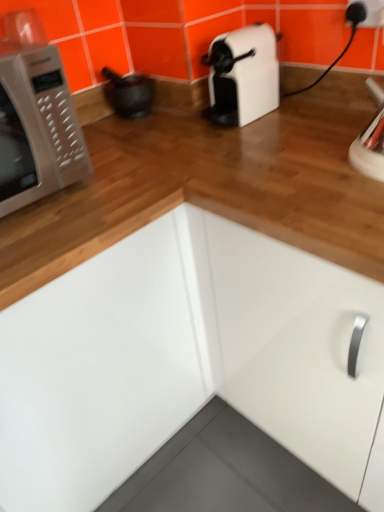
Describe the element at coordinates (183, 359) in the screenshot. I see `white glossy cabinet at center` at that location.

In order to click on white glossy cabinet at center in this screenshot , I will do `click(183, 359)`.

Is point (181, 327) positioned behind point (66, 88)?

Yes, point (181, 327) is farther from viewer.

Consider the image. Considering the positions of objects white glossy cabinet at center and white glossy microwave oven at left in the image provided, who is in front, white glossy cabinet at center or white glossy microwave oven at left?

white glossy cabinet at center is in front.

From the image's perspective, is white glossy cabinet at center below white glossy microwave oven at left?

Correct, white glossy cabinet at center appears lower than white glossy microwave oven at left in the image.

Is white glossy cabinet at center completely or partially outside of white glossy microwave oven at left?

Yes, white glossy cabinet at center is not within white glossy microwave oven at left.

In the image, is white glossy microwave oven at left on the left side or the right side of white plastic electric outlet at upper right?

From the image, it's evident that white glossy microwave oven at left is to the left of white plastic electric outlet at upper right.

Is white glossy microwave oven at left oriented away from white plastic electric outlet at upper right?

No, white plastic electric outlet at upper right is not at the back of white glossy microwave oven at left.

From the image's perspective, between white glossy microwave oven at left and white plastic electric outlet at upper right, who is located below?

white glossy microwave oven at left, from the image's perspective.

Can you tell me how much white glossy microwave oven at left and white plastic electric outlet at upper right differ in facing direction?

The angle between the facing direction of white glossy microwave oven at left and the facing direction of white plastic electric outlet at upper right is 90 degrees.

Relative to matte black mortar at upper left, is white glossy cabinet at center in front or behind?

In the image, white glossy cabinet at center appears in front of matte black mortar at upper left.

Can you tell me how much white glossy cabinet at center and matte black mortar at upper left differ in facing direction?

There is a 90-degree angle between the facing directions of white glossy cabinet at center and matte black mortar at upper left.

From a real-world perspective, is white glossy cabinet at center over matte black mortar at upper left?

No, from a real-world perspective, white glossy cabinet at center is not over matte black mortar at upper left

Which of these two, white glossy cabinet at center or matte black mortar at upper left, stands shorter?

matte black mortar at upper left is shorter.

Is white glossy microwave oven at left to the right of matte black mortar at upper left from the viewer's perspective?

Incorrect, white glossy microwave oven at left is not on the right side of matte black mortar at upper left.

From a real-world perspective, which is physically below, white glossy microwave oven at left or matte black mortar at upper left?

matte black mortar at upper left.

Considering the sizes of objects white glossy microwave oven at left and matte black mortar at upper left in the image provided, who is bigger, white glossy microwave oven at left or matte black mortar at upper left?

white glossy microwave oven at left is bigger.

From the picture: From the image's perspective, which is below, white glossy microwave oven at left or matte black mortar at upper left?

white glossy microwave oven at left is shown below in the image.

From a real-world perspective, who is located higher, white plastic electric outlet at upper right or matte black mortar at upper left?

From a 3D spatial view, white plastic electric outlet at upper right is above.

How distant is white plastic electric outlet at upper right from matte black mortar at upper left?

white plastic electric outlet at upper right is 25.90 inches away from matte black mortar at upper left.

Consider the image. From the image's perspective, is white plastic electric outlet at upper right over matte black mortar at upper left?

Correct, white plastic electric outlet at upper right appears higher than matte black mortar at upper left in the image.

Is white plastic electric outlet at upper right situated inside matte black mortar at upper left or outside?

white plastic electric outlet at upper right is not inside matte black mortar at upper left, it's outside.

Is matte black mortar at upper left shorter than white glossy microwave oven at left?

Indeed, matte black mortar at upper left has a lesser height compared to white glossy microwave oven at left.

Is the depth of matte black mortar at upper left less than that of white glossy microwave oven at left?

No, the depth of matte black mortar at upper left is greater than that of white glossy microwave oven at left.

Can you tell me how much matte black mortar at upper left and white glossy microwave oven at left differ in facing direction?

There is a 0.00326-degree angle between the facing directions of matte black mortar at upper left and white glossy microwave oven at left.

From a real-world perspective, is matte black mortar at upper left positioned under white glossy microwave oven at left based on gravity?

Yes, from a real-world perspective, matte black mortar at upper left is beneath white glossy microwave oven at left.

Could you tell me if matte black mortar at upper left is turned towards white plastic electric outlet at upper right?

No, matte black mortar at upper left is not turned towards white plastic electric outlet at upper right.

Which of these two, matte black mortar at upper left or white plastic electric outlet at upper right, stands taller?

matte black mortar at upper left is taller.

Is matte black mortar at upper left far from white plastic electric outlet at upper right?

No.

Who is smaller, matte black mortar at upper left or white plastic electric outlet at upper right?

white plastic electric outlet at upper right is smaller.

Image resolution: width=384 pixels, height=512 pixels. In order to click on cabinetry lying below the white glossy microwave oven at left (from the image's perspective) in this screenshot , I will do `click(183, 359)`.

Identify the location of microwave oven lying on the left of white plastic electric outlet at upper right. Image resolution: width=384 pixels, height=512 pixels. (37, 129).

Considering their positions, is white glossy microwave oven at left positioned closer to white plastic electric outlet at upper right than white glossy cabinet at center?

white glossy microwave oven at left lies closer to white plastic electric outlet at upper right than the other object.

From the image, which object appears to be farther from matte black mortar at upper left, white glossy cabinet at center or white glossy microwave oven at left?

white glossy cabinet at center lies further to matte black mortar at upper left than the other object.

Looking at the image, which one is located closer to white glossy cabinet at center, matte black mortar at upper left or white plastic electric outlet at upper right?

The object closer to white glossy cabinet at center is matte black mortar at upper left.

From the picture: When comparing their distances from matte black mortar at upper left, does white plastic electric outlet at upper right or white glossy microwave oven at left seem further?

A: white plastic electric outlet at upper right.

Considering their positions, is white plastic electric outlet at upper right positioned closer to white glossy cabinet at center than white glossy microwave oven at left?

The object closer to white glossy cabinet at center is white glossy microwave oven at left.

From the image, which object appears to be nearer to white glossy microwave oven at left, white plastic electric outlet at upper right or matte black mortar at upper left?

The object closer to white glossy microwave oven at left is matte black mortar at upper left.

Which object lies further to the anchor point white glossy microwave oven at left, white plastic electric outlet at upper right or white glossy cabinet at center?

Based on the image, white plastic electric outlet at upper right appears to be further to white glossy microwave oven at left.

Looking at the image, which one is located closer to white glossy microwave oven at left, white glossy cabinet at center or matte black mortar at upper left?

Among the two, matte black mortar at upper left is located nearer to white glossy microwave oven at left.

Where is `appliance between white glossy microwave oven at left and white plastic electric outlet at upper right`? This screenshot has width=384, height=512. appliance between white glossy microwave oven at left and white plastic electric outlet at upper right is located at coordinates (129, 94).

Locate an element on the screen. The height and width of the screenshot is (512, 384). microwave oven between white glossy cabinet at center and matte black mortar at upper left along the z-axis is located at coordinates (37, 129).

Image resolution: width=384 pixels, height=512 pixels. Find the location of `cabinetry between white glossy microwave oven at left and white plastic electric outlet at upper right from left to right`. cabinetry between white glossy microwave oven at left and white plastic electric outlet at upper right from left to right is located at coordinates [183, 359].

Locate an element on the screen. Image resolution: width=384 pixels, height=512 pixels. electric outlet positioned between white glossy cabinet at center and matte black mortar at upper left from near to far is located at coordinates (372, 12).